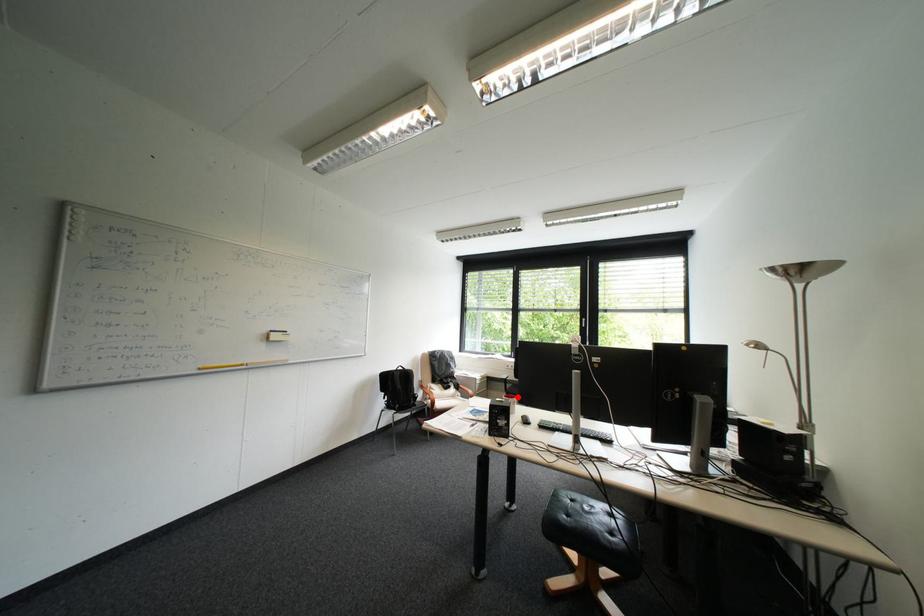
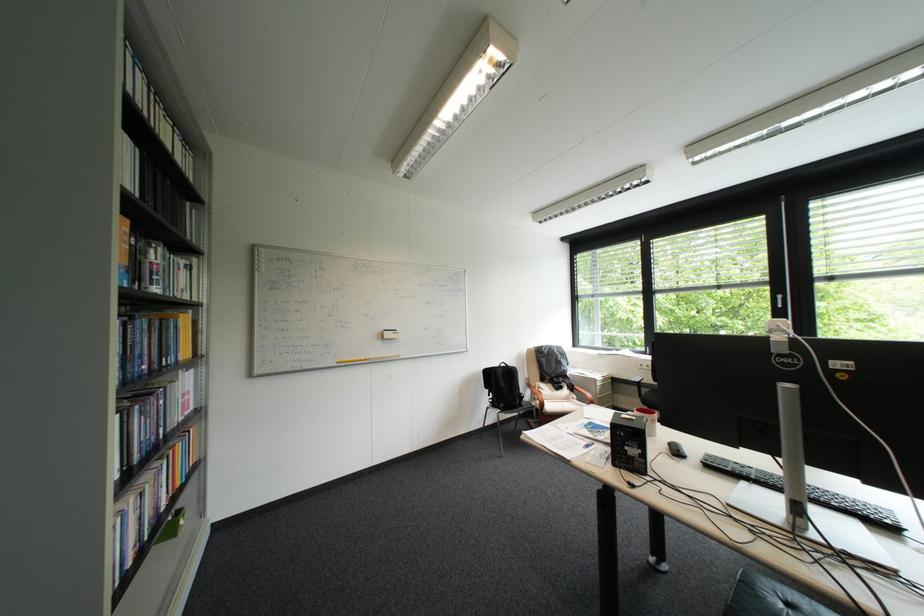
Question: A red point is marked in image1. In image2, is the corresponding 3D point closer to the camera or farther? Reply with the corresponding letter.

Choices:
 (A) The corresponding 3D point is closer.
 (B) The corresponding 3D point is farther.

Answer: (A)